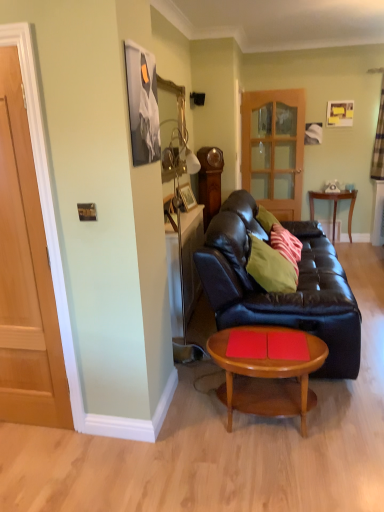
This screenshot has width=384, height=512. In order to click on free space to the left of light brown wooden coffee table at center in this screenshot , I will do `click(182, 434)`.